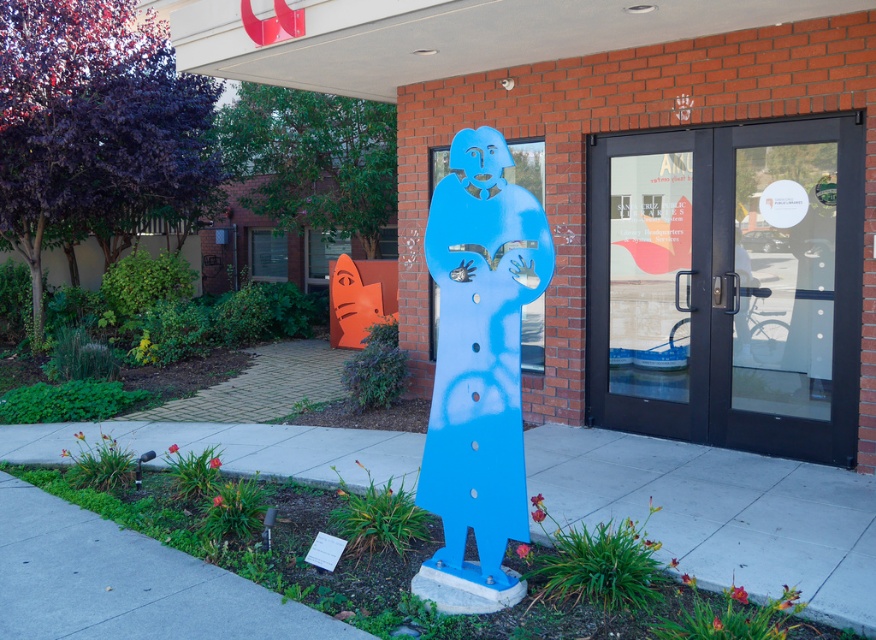
You are a visitor approaching the SAN CRUZ PUBLIC LIBRARY and see the black glass doors at center and the blue matte sculpture at center. Which object is closer to your left side as you face the building?

The blue matte sculpture at center is closer to your left side as you face the building because the black glass doors at center is to the right of blue matte sculpture at center.

You are a visitor approaching the SAN CRUZ PUBLIC LIBRARY and see the black glass doors at center and the blue matte sculpture at center. Which object is taller?

The black glass doors at center is much taller than the blue matte sculpture at center.

Looking at this image, you are standing in front of the building and want to enter the SAN CRUZ PUBLIC LIBRARY. Where are the black glass doors at center located in terms of their 2D coordinates?

The black glass doors at center are located at the 2D coordinates of point (728, 285).